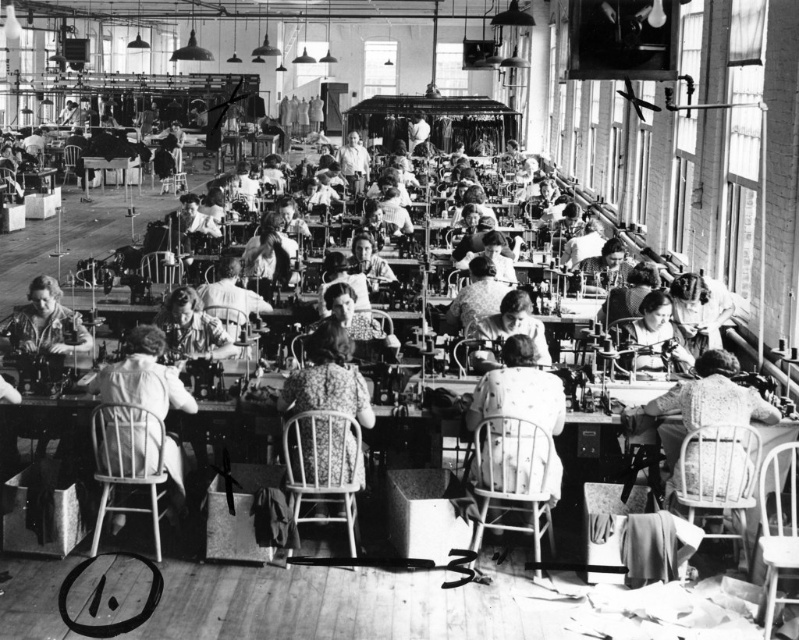
Question: Can you confirm if wooden table at center is bigger than floral fabric dress at center?

Choices:
 (A) yes
 (B) no

Answer: (B)

Question: Is wooden table at center thinner than floral fabric dress at center?

Choices:
 (A) yes
 (B) no

Answer: (B)

Question: Does wooden table at center have a smaller size compared to floral fabric dress at center?

Choices:
 (A) yes
 (B) no

Answer: (A)

Question: Among these objects, which one is farthest from the camera?

Choices:
 (A) wooden table at center
 (B) floral fabric dress at center

Answer: (A)